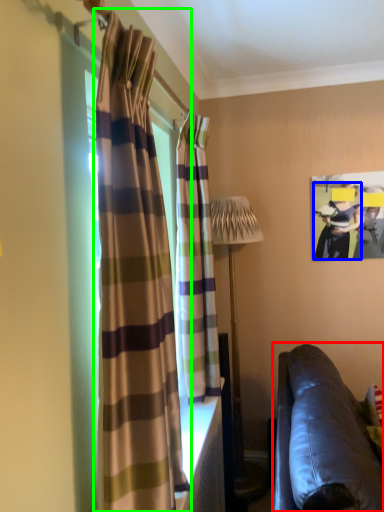
Question: Based on their relative distances, which object is farther from studio couch (highlighted by a red box)? Choose from person (highlighted by a blue box) and curtain (highlighted by a green box).

Choices:
 (A) person
 (B) curtain

Answer: (A)